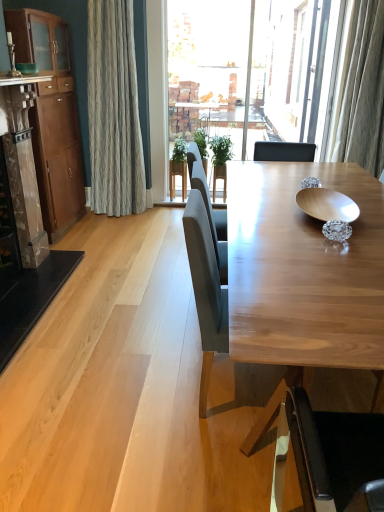
Question: In which direction should I rotate to look at light brown wood chair at center, arranged as the 1th chair when viewed from the front?

Choices:
 (A) left
 (B) right

Answer: (B)

Question: Does brown wood cabinet at left have a greater height compared to marble fireplace at left?

Choices:
 (A) no
 (B) yes

Answer: (B)

Question: Can marble fireplace at left be found inside brown wood cabinet at left?

Choices:
 (A) yes
 (B) no

Answer: (B)

Question: From the image's perspective, is brown wood cabinet at left above marble fireplace at left?

Choices:
 (A) yes
 (B) no

Answer: (A)

Question: Is brown wood cabinet at left shorter than marble fireplace at left?

Choices:
 (A) no
 (B) yes

Answer: (A)

Question: Considering the relative positions of brown wood cabinet at left and marble fireplace at left in the image provided, is brown wood cabinet at left to the right of marble fireplace at left from the viewer's perspective?

Choices:
 (A) yes
 (B) no

Answer: (B)

Question: Can you confirm if brown wood cabinet at left is wider than marble fireplace at left?

Choices:
 (A) yes
 (B) no

Answer: (B)

Question: From a real-world perspective, is matte gray chair at center, the second chair viewed from the front, positioned under wooden bowl at center based on gravity?

Choices:
 (A) yes
 (B) no

Answer: (A)

Question: Is matte gray chair at center, the 1th chair viewed from the back, facing away from wooden bowl at center?

Choices:
 (A) yes
 (B) no

Answer: (B)

Question: Considering the relative sizes of matte gray chair at center, the 1th chair viewed from the back, and wooden bowl at center in the image provided, is matte gray chair at center, the 1th chair viewed from the back, shorter than wooden bowl at center?

Choices:
 (A) yes
 (B) no

Answer: (B)

Question: Is matte gray chair at center, the 1th chair viewed from the back, to the right of wooden bowl at center from the viewer's perspective?

Choices:
 (A) yes
 (B) no

Answer: (B)

Question: From a real-world perspective, is matte gray chair at center, the 1th chair viewed from the back, over wooden bowl at center?

Choices:
 (A) no
 (B) yes

Answer: (A)

Question: From the image's perspective, is matte gray chair at center, the 1th chair viewed from the back, on wooden bowl at center?

Choices:
 (A) yes
 (B) no

Answer: (B)

Question: Is light brown wood chair at center, acting as the 2th chair starting from the back, located within marble fireplace at left?

Choices:
 (A) no
 (B) yes

Answer: (A)